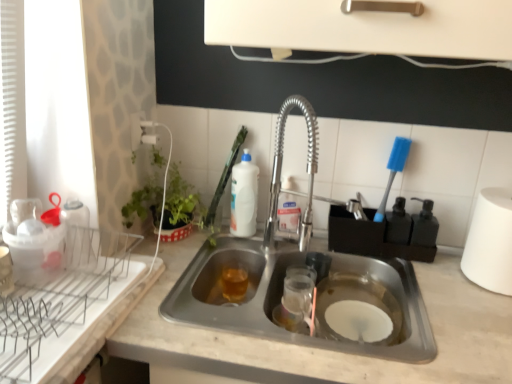
Locate an element on the screen. This screenshot has height=384, width=512. translucent amber liquid at sink bottom, the 1th beverage in the bottom-to-top sequence is located at coordinates (234, 284).

What do you see at coordinates (244, 197) in the screenshot? I see `white glossy bottle at upper center, arranged as the first beverage when viewed from the top` at bounding box center [244, 197].

I want to click on white matte paper towel at right, so click(490, 242).

Do you think translucent amber liquid at sink bottom, which ranks as the 2th beverage in top-to-bottom order, is within white marble countertop at center, or outside of it?

translucent amber liquid at sink bottom, which ranks as the 2th beverage in top-to-bottom order, is contained in white marble countertop at center.

Locate an element on the screen. This screenshot has width=512, height=384. the 1st beverage behind the white marble countertop at center is located at coordinates (234, 284).

From the image's perspective, which one is positioned lower, translucent amber liquid at sink bottom, which ranks as the 2th beverage in top-to-bottom order, or white marble countertop at center?

white marble countertop at center appears lower in the image.

Could you measure the distance between translucent amber liquid at sink bottom, the 1th beverage in the bottom-to-top sequence, and white marble countertop at center?

16.84 inches.

From the image's perspective, is white plastic brush at upper center above or below translucent amber liquid at sink bottom, which ranks as the 2th beverage in top-to-bottom order?

Clearly, from the image's perspective, white plastic brush at upper center is above translucent amber liquid at sink bottom, which ranks as the 2th beverage in top-to-bottom order.

Which of these two, white plastic brush at upper center or translucent amber liquid at sink bottom, the 1th beverage in the bottom-to-top sequence, is thinner?

Thinner between the two is translucent amber liquid at sink bottom, the 1th beverage in the bottom-to-top sequence.

Which is behind, point (209, 211) or point (233, 298)?

The point (209, 211) is behind.

From a real-world perspective, which is physically above, white plastic brush at upper center or translucent amber liquid at sink bottom, the 1th beverage in the bottom-to-top sequence?

white plastic brush at upper center, from a real-world perspective.

Looking at the image, does white marble countertop at center seem bigger or smaller compared to translucent amber liquid at sink bottom, the 1th beverage in the bottom-to-top sequence?

white marble countertop at center is bigger than translucent amber liquid at sink bottom, the 1th beverage in the bottom-to-top sequence.

Starting from the white marble countertop at center, which beverage is the 2nd one to the left? Please provide its 2D coordinates.

[(234, 284)]

Consider the image. Which object is closer to the camera taking this photo, white marble countertop at center or translucent amber liquid at sink bottom, the 1th beverage in the bottom-to-top sequence?

white marble countertop at center is in front.

Could you tell me if white marble countertop at center is turned towards translucent amber liquid at sink bottom, which ranks as the 2th beverage in top-to-bottom order?

No, white marble countertop at center is not facing towards translucent amber liquid at sink bottom, which ranks as the 2th beverage in top-to-bottom order.

Between translucent amber liquid at sink bottom, the 1th beverage in the bottom-to-top sequence, and white plastic brush at upper center, which one appears on the left side from the viewer's perspective?

From the viewer's perspective, white plastic brush at upper center appears more on the left side.

From a real-world perspective, is translucent amber liquid at sink bottom, which ranks as the 2th beverage in top-to-bottom order, physically above white plastic brush at upper center?

Actually, translucent amber liquid at sink bottom, which ranks as the 2th beverage in top-to-bottom order, is physically below white plastic brush at upper center in the real world.

Considering the positions of points (225, 275) and (219, 185), is point (225, 275) closer to camera compared to point (219, 185)?

Yes, it is.

Measure the distance from white glossy bottle at upper center, arranged as the first beverage when viewed from the top, to translucent amber liquid at sink bottom, the 1th beverage in the bottom-to-top sequence.

white glossy bottle at upper center, arranged as the first beverage when viewed from the top, is 8.00 inches from translucent amber liquid at sink bottom, the 1th beverage in the bottom-to-top sequence.

From the image's perspective, which one is positioned higher, white glossy bottle at upper center, the second beverage positioned from the bottom, or translucent amber liquid at sink bottom, which ranks as the 2th beverage in top-to-bottom order?

white glossy bottle at upper center, the second beverage positioned from the bottom, appears higher in the image.

Based on the photo, which object is wider, white glossy bottle at upper center, arranged as the first beverage when viewed from the top, or translucent amber liquid at sink bottom, the 1th beverage in the bottom-to-top sequence?

With larger width is white glossy bottle at upper center, arranged as the first beverage when viewed from the top.

How much distance is there between white glossy bottle at upper center, the second beverage positioned from the bottom, and white matte paper towel at right?

25.86 inches.

Is white matte paper towel at right completely or partially inside white glossy bottle at upper center, arranged as the first beverage when viewed from the top?

No, white matte paper towel at right is not surrounded by white glossy bottle at upper center, arranged as the first beverage when viewed from the top.

Is white glossy bottle at upper center, arranged as the first beverage when viewed from the top, positioned before white matte paper towel at right?

No, it is behind white matte paper towel at right.

Does translucent amber liquid at sink bottom, which ranks as the 2th beverage in top-to-bottom order, have a greater width compared to white matte paper towel at right?

Incorrect, the width of translucent amber liquid at sink bottom, which ranks as the 2th beverage in top-to-bottom order, does not surpass that of white matte paper towel at right.

From the image's perspective, is translucent amber liquid at sink bottom, the 1th beverage in the bottom-to-top sequence, above or below white matte paper towel at right?

translucent amber liquid at sink bottom, the 1th beverage in the bottom-to-top sequence, is below white matte paper towel at right.

Is translucent amber liquid at sink bottom, which ranks as the 2th beverage in top-to-bottom order, oriented towards white matte paper towel at right?

Yes, translucent amber liquid at sink bottom, which ranks as the 2th beverage in top-to-bottom order, is facing white matte paper towel at right.

Which is less distant, (x=240, y=275) or (x=489, y=260)?

The point (x=489, y=260) is closer to the camera.

I want to click on the 2nd beverage counting from the left of the white marble countertop at center, so click(234, 284).

Where is `beverage that is the 2nd one when counting downward from the white plastic brush at upper center (from the image's perspective)`? beverage that is the 2nd one when counting downward from the white plastic brush at upper center (from the image's perspective) is located at coordinates (234, 284).

When comparing their distances from white glossy bottle at upper center, arranged as the first beverage when viewed from the top, does translucent amber liquid at sink bottom, the 1th beverage in the bottom-to-top sequence, or white matte paper towel at right seem closer?

translucent amber liquid at sink bottom, the 1th beverage in the bottom-to-top sequence, is closer to white glossy bottle at upper center, arranged as the first beverage when viewed from the top.

Considering their positions, is translucent amber liquid at sink bottom, the 1th beverage in the bottom-to-top sequence, positioned further to white plastic brush at upper center than white marble countertop at center?

white marble countertop at center is further to white plastic brush at upper center.

When comparing their distances from white plastic brush at upper center, does white matte paper towel at right or white glossy bottle at upper center, arranged as the first beverage when viewed from the top, seem closer?

white glossy bottle at upper center, arranged as the first beverage when viewed from the top, is closer to white plastic brush at upper center.

Considering their positions, is white matte paper towel at right positioned closer to translucent amber liquid at sink bottom, which ranks as the 2th beverage in top-to-bottom order, than white plastic brush at upper center?

white plastic brush at upper center is positioned closer to the anchor translucent amber liquid at sink bottom, which ranks as the 2th beverage in top-to-bottom order.

When comparing their distances from translucent amber liquid at sink bottom, the 1th beverage in the bottom-to-top sequence, does white matte paper towel at right or white glossy bottle at upper center, the second beverage positioned from the bottom, seem closer?

The object closer to translucent amber liquid at sink bottom, the 1th beverage in the bottom-to-top sequence, is white glossy bottle at upper center, the second beverage positioned from the bottom.

From the image, which object appears to be nearer to white plastic brush at upper center, white glossy bottle at upper center, the second beverage positioned from the bottom, or white marble countertop at center?

white glossy bottle at upper center, the second beverage positioned from the bottom.

Based on their spatial positions, is white marble countertop at center or white matte paper towel at right further from white plastic brush at upper center?

white matte paper towel at right is positioned further to the anchor white plastic brush at upper center.

Based on the photo, which object lies further to the anchor point white plastic brush at upper center, white glossy bottle at upper center, arranged as the first beverage when viewed from the top, or translucent amber liquid at sink bottom, the 1th beverage in the bottom-to-top sequence?

translucent amber liquid at sink bottom, the 1th beverage in the bottom-to-top sequence, is positioned further to the anchor white plastic brush at upper center.

The width and height of the screenshot is (512, 384). What are the coordinates of `countertop between translucent amber liquid at sink bottom, the 1th beverage in the bottom-to-top sequence, and white matte paper towel at right from left to right` in the screenshot? It's located at (327, 350).

Locate an element on the screen. This screenshot has height=384, width=512. beverage between white glossy bottle at upper center, the second beverage positioned from the bottom, and white marble countertop at center, in the vertical direction is located at coordinates (234, 284).

You are a GUI agent. You are given a task and a screenshot of the screen. Output one action in this format:
    pyautogui.click(x=<x>, y=<y>)
    Task: Click on the countertop between white glossy bottle at upper center, arranged as the first beverage when viewed from the top, and white matte paper towel at right, in the horizontal direction
    
    Given the screenshot: What is the action you would take?
    pyautogui.click(x=327, y=350)

Image resolution: width=512 pixels, height=384 pixels. I want to click on countertop situated between white plastic brush at upper center and white matte paper towel at right from left to right, so click(327, 350).